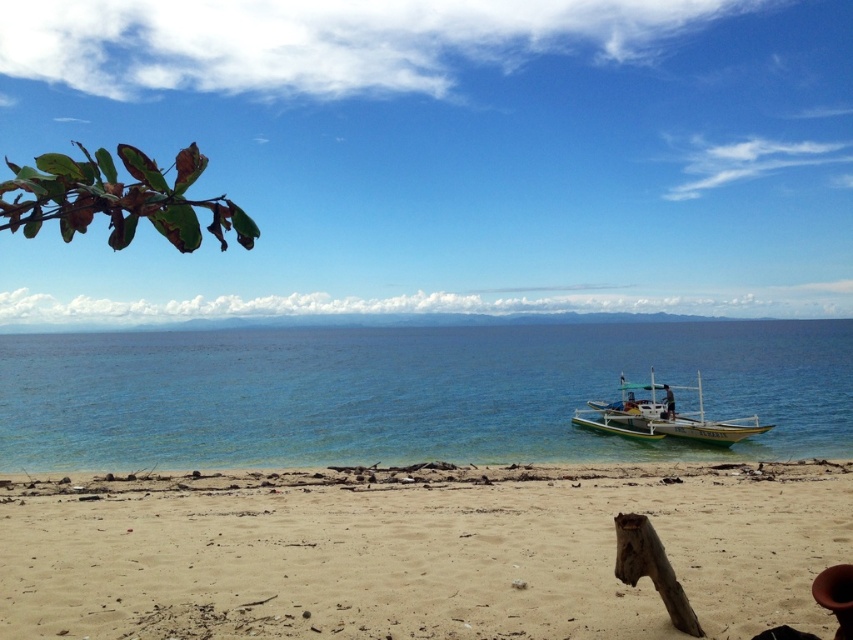
Question: Does sandy beach at lower center come in front of blue clear water at center?

Choices:
 (A) yes
 (B) no

Answer: (A)

Question: Can you confirm if sandy beach at lower center is positioned above blue clear water at center?

Choices:
 (A) no
 (B) yes

Answer: (A)

Question: Is sandy beach at lower center to the right of green wooden boat at lower right from the viewer's perspective?

Choices:
 (A) no
 (B) yes

Answer: (A)

Question: Which point is farther to the camera?

Choices:
 (A) green wooden boat at lower right
 (B) blue clear water at center

Answer: (A)

Question: Among these objects, which one is farthest from the camera?

Choices:
 (A) sandy beach at lower center
 (B) green wooden boat at lower right

Answer: (B)

Question: Which point is farther to the camera?

Choices:
 (A) (509, 573)
 (B) (737, 429)
 (C) (392, 429)

Answer: (C)